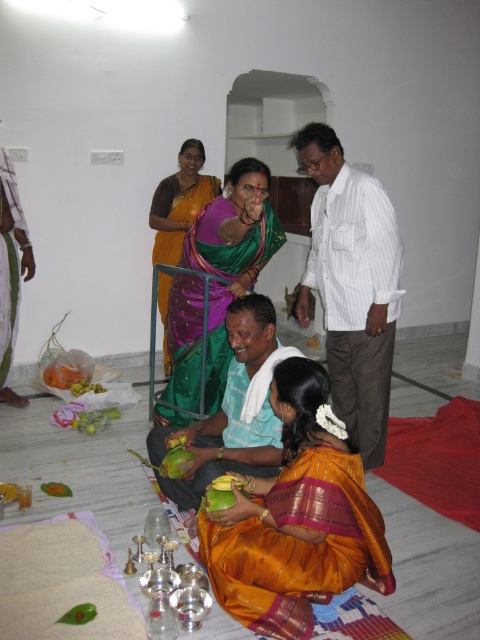
In the scene shown: Which is below, green silk saree at upper center or yellow matte coconut at lower left?

yellow matte coconut at lower left

Is point (0, 339) more distant than point (4, 483)?

Yes, point (0, 339) is farther from viewer.

Where is `green silk saree at upper center`? This screenshot has width=480, height=640. green silk saree at upper center is located at coordinates (11, 275).

What do you see at coordinates (351, 284) in the screenshot? I see `white striped shirt at upper center` at bounding box center [351, 284].

Who is positioned more to the left, white striped shirt at upper center or silky purple sari at center?

silky purple sari at center

Is point (364, 308) less distant than point (189, 184)?

Yes, it is.

The image size is (480, 640). I want to click on white striped shirt at upper center, so click(351, 284).

Looking at this image, who is taller, golden silk saree at center or white striped shirt at upper center?

white striped shirt at upper center

Is golden silk saree at center smaller than white striped shirt at upper center?

Correct, golden silk saree at center occupies less space than white striped shirt at upper center.

The width and height of the screenshot is (480, 640). In order to click on golden silk saree at center in this screenshot , I will do `click(297, 518)`.

This screenshot has height=640, width=480. I want to click on golden silk saree at center, so click(x=297, y=518).